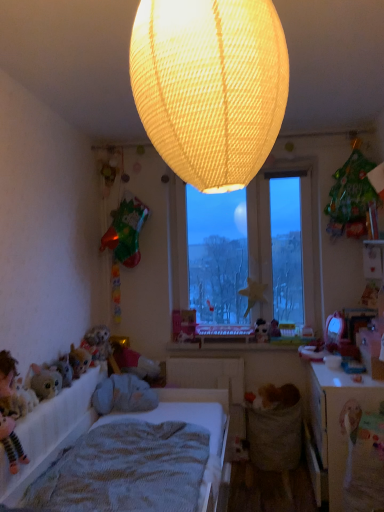
Find the location of `wooden table at lower right`. wooden table at lower right is located at coordinates (338, 419).

Describe the element at coordinates (351, 196) in the screenshot. The height and width of the screenshot is (512, 384). I see `green matte bag at upper right, which ranks as the second toy in left-to-right order` at that location.

Image resolution: width=384 pixels, height=512 pixels. I want to click on green matte bag at upper right, the first toy from the right, so click(x=351, y=196).

Describe the element at coordinates (270, 239) in the screenshot. I see `transparent glass window at center` at that location.

At what (x,y) coordinates should I click in order to perform the action: click on gray plush toy at lower left. Please return your answer as a coordinate pair (x, y). This screenshot has height=512, width=384. Looking at the image, I should click on (124, 395).

The image size is (384, 512). What do you see at coordinates (124, 395) in the screenshot? I see `gray plush toy at lower left` at bounding box center [124, 395].

Where is `matte yellow fabric lampshade at upper center`? The image size is (384, 512). matte yellow fabric lampshade at upper center is located at coordinates point(210,86).

Could you tell me if wooden table at lower right is turned towards matte plastic toy at center, marked as the 2th toy in a top-to-bottom arrangement?

No, wooden table at lower right is not turned towards matte plastic toy at center, marked as the 2th toy in a top-to-bottom arrangement.

Looking at this image, which is less distant, (324, 422) or (258, 334)?

The point (324, 422) is more forward.

Is wooden table at lower right positioned behind matte plastic toy at center, the 1th toy when ordered from bottom to top?

No, it is not.

From a real-world perspective, between smooth plastic window sill at center and matte yellow fabric lampshade at upper center, who is vertically lower?

From a 3D spatial view, smooth plastic window sill at center is below.

Considering the relative sizes of smooth plastic window sill at center and matte yellow fabric lampshade at upper center in the image provided, is smooth plastic window sill at center taller than matte yellow fabric lampshade at upper center?

Incorrect, the height of smooth plastic window sill at center is not larger of that of matte yellow fabric lampshade at upper center.

Is smooth plastic window sill at center not within matte yellow fabric lampshade at upper center?

Yes, smooth plastic window sill at center is outside of matte yellow fabric lampshade at upper center.

You are a GUI agent. You are given a task and a screenshot of the screen. Output one action in this format:
    pyautogui.click(x=<x>, y=<y>)
    Task: Click on the lamp above the smooth plastic window sill at center (from the image's perspective)
    
    Given the screenshot: What is the action you would take?
    click(x=210, y=86)

From the image's perspective, is green matte bag at upper right, which is counted as the 2th toy, starting from the bottom, above or below matte plastic toy at center, marked as the 2th toy in a top-to-bottom arrangement?

Based on their image positions, green matte bag at upper right, which is counted as the 2th toy, starting from the bottom, is located above matte plastic toy at center, marked as the 2th toy in a top-to-bottom arrangement.

Does green matte bag at upper right, which is counted as the first toy, starting from the front, appear on the right side of matte plastic toy at center, arranged as the second toy when viewed from the right?

Yes, green matte bag at upper right, which is counted as the first toy, starting from the front, is to the right of matte plastic toy at center, arranged as the second toy when viewed from the right.

Which point is more forward, (363, 169) or (263, 324)?

The point (363, 169) is in front.

Is green matte bag at upper right, the first toy from the right, bigger or smaller than matte plastic toy at center, marked as the first toy in a left-to-right arrangement?

In the image, green matte bag at upper right, the first toy from the right, appears to be larger than matte plastic toy at center, marked as the first toy in a left-to-right arrangement.

In the image, there is a smooth plastic window sill at center. Where is `bed below it (from the image's perspective)`? bed below it (from the image's perspective) is located at coordinates (49, 434).

Can you confirm if white fabric bed at lower left is bigger than smooth plastic window sill at center?

Yes, white fabric bed at lower left is bigger than smooth plastic window sill at center.

Is point (49, 449) closer to camera compared to point (302, 343)?

Yes, point (49, 449) is in front of point (302, 343).

Can you confirm if white fabric bed at lower left is thinner than smooth plastic window sill at center?

No, white fabric bed at lower left is not thinner than smooth plastic window sill at center.

From a real-world perspective, who is located lower, matte plastic toy at center, marked as the first toy in a left-to-right arrangement, or fluffy plush toy at lower left?

fluffy plush toy at lower left is physically lower.

Considering the sizes of objects matte plastic toy at center, marked as the first toy in a left-to-right arrangement, and fluffy plush toy at lower left in the image provided, who is wider, matte plastic toy at center, marked as the first toy in a left-to-right arrangement, or fluffy plush toy at lower left?

fluffy plush toy at lower left.

Consider the image. From the image's perspective, is matte plastic toy at center, the second toy when ordered from front to back, positioned above or below fluffy plush toy at lower left?

From the image's perspective, matte plastic toy at center, the second toy when ordered from front to back, appears above fluffy plush toy at lower left.

Considering their positions, is matte plastic toy at center, marked as the first toy in a left-to-right arrangement, located in front of or behind fluffy plush toy at lower left?

matte plastic toy at center, marked as the first toy in a left-to-right arrangement, is behind fluffy plush toy at lower left.

Is matte plastic toy at center, marked as the first toy in a left-to-right arrangement, aimed at matte yellow fabric lampshade at upper center?

Yes, matte plastic toy at center, marked as the first toy in a left-to-right arrangement, faces towards matte yellow fabric lampshade at upper center.

Between matte plastic toy at center, marked as the 2th toy in a top-to-bottom arrangement, and matte yellow fabric lampshade at upper center, which one has less height?

Standing shorter between the two is matte plastic toy at center, marked as the 2th toy in a top-to-bottom arrangement.

Measure the distance between matte plastic toy at center, the 1th toy when ordered from bottom to top, and matte yellow fabric lampshade at upper center.

matte plastic toy at center, the 1th toy when ordered from bottom to top, is 8.94 feet from matte yellow fabric lampshade at upper center.

Is matte plastic toy at center, marked as the 2th toy in a top-to-bottom arrangement, not within matte yellow fabric lampshade at upper center?

Indeed, matte plastic toy at center, marked as the 2th toy in a top-to-bottom arrangement, is completely outside matte yellow fabric lampshade at upper center.

Could you tell me if gray plush toy at lower left is facing transparent glass window at center?

No, gray plush toy at lower left is not facing towards transparent glass window at center.

Which of these two, gray plush toy at lower left or transparent glass window at center, is wider?

gray plush toy at lower left.

From the image's perspective, would you say gray plush toy at lower left is positioned over transparent glass window at center?

Incorrect, from the image's perspective, gray plush toy at lower left is lower than transparent glass window at center.

From the image's perspective, count 1st toys upward from the wooden table at lower right and point to it. Please provide its 2D coordinates.

[(262, 331)]

Find the location of `window sill behind the matte yellow fabric lampshade at upper center`. window sill behind the matte yellow fabric lampshade at upper center is located at coordinates (237, 345).

Which object lies nearer to the anchor point white fabric bed at lower left, green matte bag at upper right, the first toy from the right, or transparent glass window at center?

transparent glass window at center is closer to white fabric bed at lower left.

Looking at this image, estimate the real-world distances between objects in this image. Which object is closer to white fabric bed at lower left, knitted fabric mattress at lower left or wooden table at lower right?

knitted fabric mattress at lower left is positioned closer to the anchor white fabric bed at lower left.

From the image, which object appears to be farther from knitted fabric mattress at lower left, transparent glass window at center or fluffy plush toy at lower left?

The object further to knitted fabric mattress at lower left is transparent glass window at center.

From the image, which object appears to be farther from gray plush toy at lower left, wooden table at lower right or fluffy plush toy at lower left?

wooden table at lower right is further to gray plush toy at lower left.

Based on their spatial positions, is matte yellow fabric lampshade at upper center or green matte bag at upper right, the first toy from the right, closer to knitted fabric mattress at lower left?

matte yellow fabric lampshade at upper center is closer to knitted fabric mattress at lower left.

Estimate the real-world distances between objects in this image. Which object is closer to smooth plastic window sill at center, green matte bag at upper right, which is counted as the first toy, starting from the front, or white fabric bed at lower left?

white fabric bed at lower left is closer to smooth plastic window sill at center.

Considering their positions, is transparent glass window at center positioned closer to wooden table at lower right than matte plastic toy at center, arranged as the first toy when viewed from the back?

matte plastic toy at center, arranged as the first toy when viewed from the back.

Based on the photo, when comparing their distances from fluffy plush toy at lower left, does gray plush toy at lower left or transparent glass window at center seem closer?

gray plush toy at lower left is positioned closer to the anchor fluffy plush toy at lower left.

Find the location of `mattress located between white fabric bed at lower left and smooth plastic window sill at center in the depth direction`. mattress located between white fabric bed at lower left and smooth plastic window sill at center in the depth direction is located at coordinates (128, 469).

Locate an element on the screen. This screenshot has height=512, width=384. animal between white fabric bed at lower left and smooth plastic window sill at center along the z-axis is located at coordinates (124, 395).

The width and height of the screenshot is (384, 512). I want to click on window positioned between knitted fabric mattress at lower left and matte plastic toy at center, arranged as the second toy when viewed from the right, from near to far, so click(270, 239).

This screenshot has width=384, height=512. I want to click on bed positioned between matte yellow fabric lampshade at upper center and matte plastic toy at center, arranged as the first toy when viewed from the back, from near to far, so click(x=49, y=434).